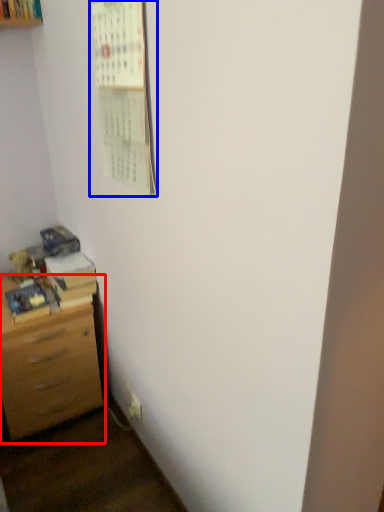
Question: Which point is closer to the camera, chest of drawers (highlighted by a red box) or bulletin board (highlighted by a blue box)?

Choices:
 (A) chest of drawers
 (B) bulletin board

Answer: (B)